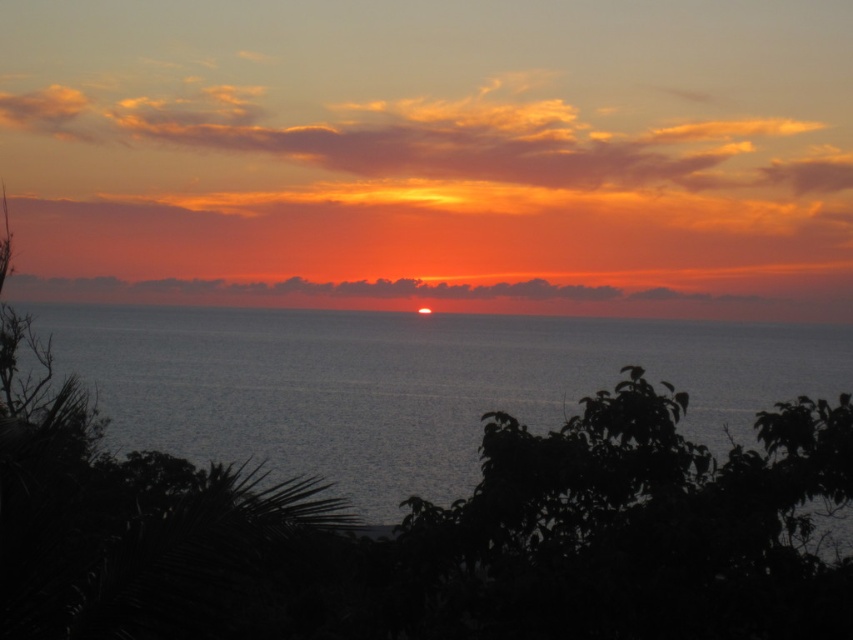
Looking at this image, is blue water at center positioned at the back of smooth ocean at center?

No, blue water at center is in front of smooth ocean at center.

I want to click on blue water at center, so click(409, 384).

Image resolution: width=853 pixels, height=640 pixels. Find the location of `blue water at center`. blue water at center is located at coordinates (x=409, y=384).